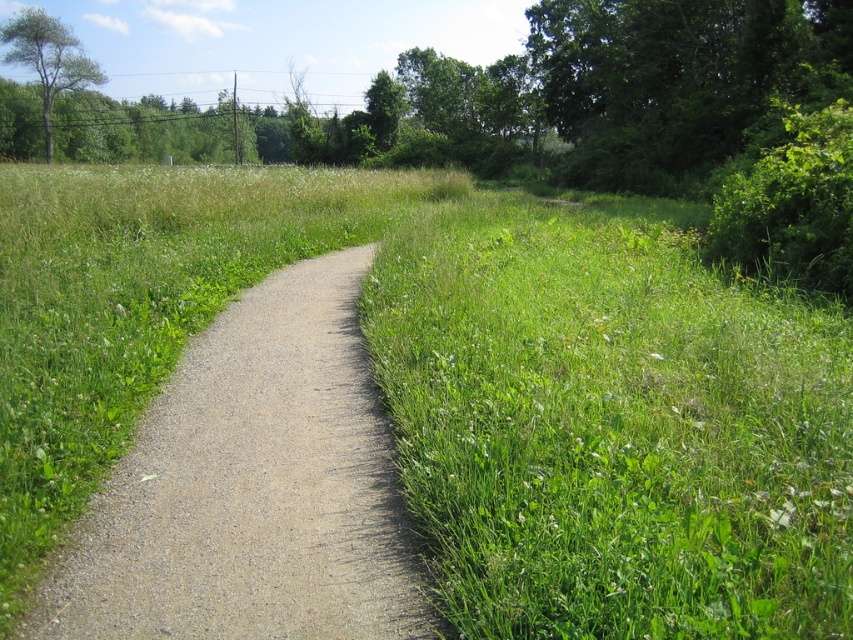
Which is more to the left, gray gravel path at center or green leafy tree at upper left?

green leafy tree at upper left

Identify the location of gray gravel path at center. tap(251, 488).

I want to click on gray gravel path at center, so click(x=251, y=488).